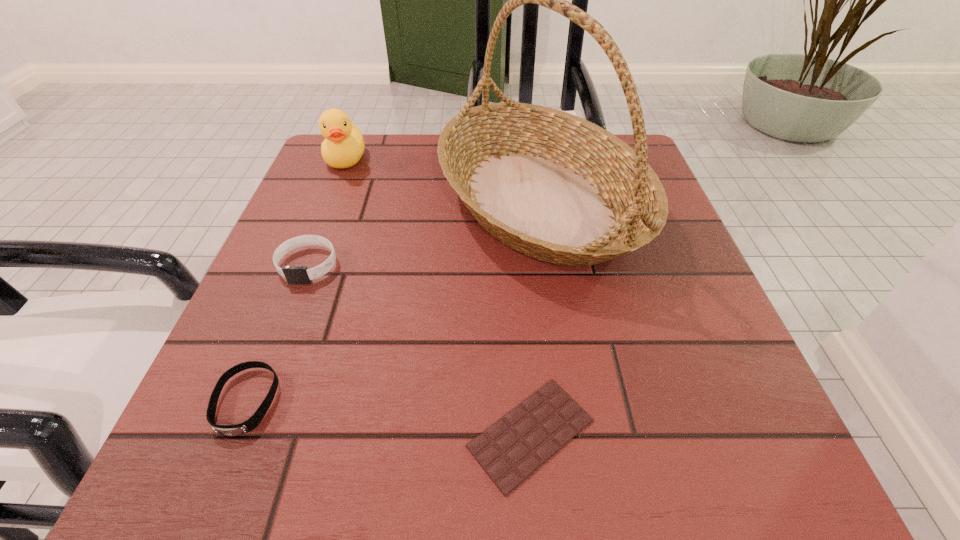
The height and width of the screenshot is (540, 960). In the image, there is a desktop. Identify the location of vacant area at the near edge. (310, 497).

You are a GUI agent. You are given a task and a screenshot of the screen. Output one action in this format:
    pyautogui.click(x=<x>, y=<y>)
    Task: Click on the free space at the left edge
    The image size is (960, 540).
    Given the screenshot: What is the action you would take?
    pyautogui.click(x=321, y=399)

The height and width of the screenshot is (540, 960). Identify the location of free space at the right edge. (722, 358).

Find the location of a particular element. free space at the far left corner of the desktop is located at coordinates (334, 188).

Identify the location of free space at the near left corner. (281, 445).

Locate an element on the screen. vacant area at the near right corner of the desktop is located at coordinates (719, 426).

Where is `unoccupied area between the chocolate bar and the tallest object`? The width and height of the screenshot is (960, 540). unoccupied area between the chocolate bar and the tallest object is located at coordinates (535, 316).

Locate an element on the screen. This screenshot has height=540, width=960. vacant space that's between the fourth tallest object and the taller wristband is located at coordinates (276, 333).

You are a GUI agent. You are given a task and a screenshot of the screen. Output one action in this format:
    pyautogui.click(x=<x>, y=<y>)
    Task: Click on the blank region between the shortest object and the second tallest object
    The width and height of the screenshot is (960, 540).
    Given the screenshot: What is the action you would take?
    pyautogui.click(x=438, y=296)

The width and height of the screenshot is (960, 540). I want to click on free space between the chocolate bar and the third tallest object, so click(x=420, y=349).